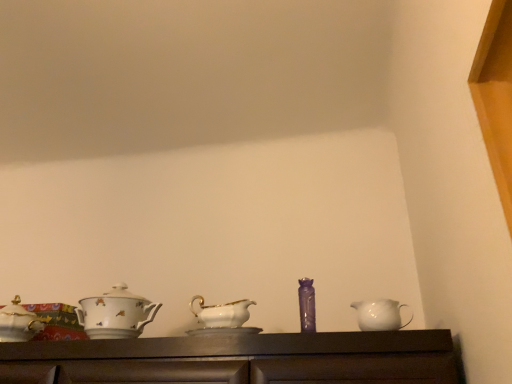
Question: Would you consider white porcelain teapot at left, which appears as the 2th tableware when viewed from the right, to be distant from purple glass vase at center, which appears as the 2th tableware when viewed from the left?

Choices:
 (A) no
 (B) yes

Answer: (A)

Question: Is white porcelain teapot at left, which ranks as the first tableware in left-to-right order, to the left of purple glass vase at center, marked as the 1th tableware in a right-to-left arrangement, from the viewer's perspective?

Choices:
 (A) yes
 (B) no

Answer: (A)

Question: Is white porcelain teapot at left, which appears as the 2th tableware when viewed from the right, located outside purple glass vase at center, marked as the 1th tableware in a right-to-left arrangement?

Choices:
 (A) no
 (B) yes

Answer: (B)

Question: Does white porcelain teapot at left, which appears as the 2th tableware when viewed from the right, have a greater height compared to purple glass vase at center, marked as the 1th tableware in a right-to-left arrangement?

Choices:
 (A) yes
 (B) no

Answer: (A)

Question: Is white porcelain teapot at left, which ranks as the first tableware in left-to-right order, turned away from purple glass vase at center, which appears as the 2th tableware when viewed from the left?

Choices:
 (A) yes
 (B) no

Answer: (B)

Question: Considering the positions of white porcelain teapot at left, which ranks as the first tableware in left-to-right order, and white glossy jug at right in the image, is white porcelain teapot at left, which ranks as the first tableware in left-to-right order, taller or shorter than white glossy jug at right?

Choices:
 (A) short
 (B) tall

Answer: (B)

Question: From a real-world perspective, is white porcelain teapot at left, which ranks as the first tableware in left-to-right order, physically located above or below white glossy jug at right?

Choices:
 (A) above
 (B) below

Answer: (A)

Question: Is point (115, 337) closer or farther from the camera than point (394, 314)?

Choices:
 (A) farther
 (B) closer

Answer: (A)

Question: Would you say white porcelain teapot at left, which appears as the 2th tableware when viewed from the right, is to the left or to the right of white glossy jug at right in the picture?

Choices:
 (A) left
 (B) right

Answer: (A)

Question: Do you think white glossy jug at right is within purple glass vase at center, which appears as the 2th tableware when viewed from the left, or outside of it?

Choices:
 (A) outside
 (B) inside

Answer: (A)

Question: From the image's perspective, relative to purple glass vase at center, marked as the 1th tableware in a right-to-left arrangement, is white glossy jug at right above or below?

Choices:
 (A) above
 (B) below

Answer: (B)

Question: Is point (411, 317) positioned closer to the camera than point (302, 314)?

Choices:
 (A) closer
 (B) farther

Answer: (B)

Question: In terms of size, does white glossy jug at right appear bigger or smaller than purple glass vase at center, which appears as the 2th tableware when viewed from the left?

Choices:
 (A) big
 (B) small

Answer: (A)

Question: From the image's perspective, relative to white porcelain teapot at left, which ranks as the first tableware in left-to-right order, is white glossy jug at right above or below?

Choices:
 (A) above
 (B) below

Answer: (A)

Question: Is white glossy jug at right taller or shorter than white porcelain teapot at left, which ranks as the first tableware in left-to-right order?

Choices:
 (A) tall
 (B) short

Answer: (B)